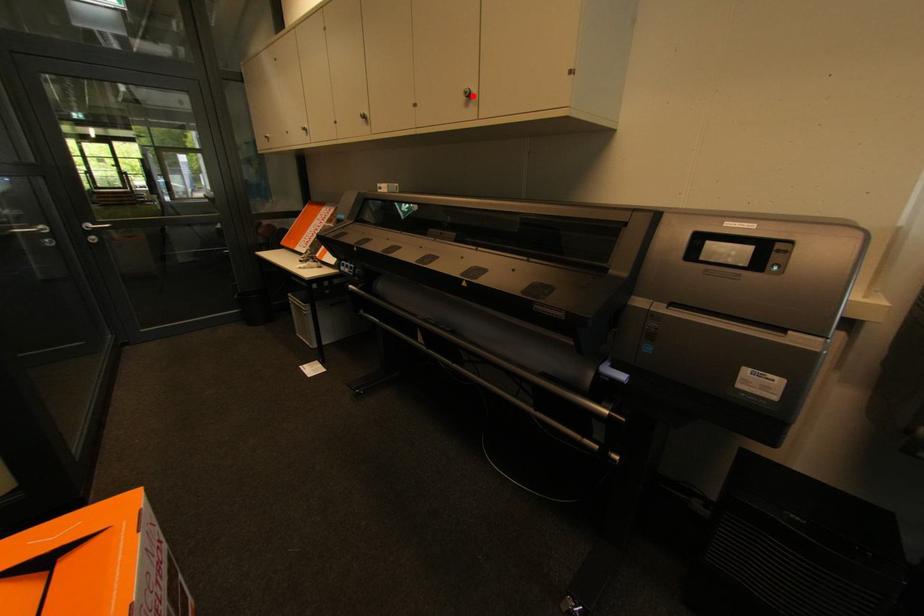
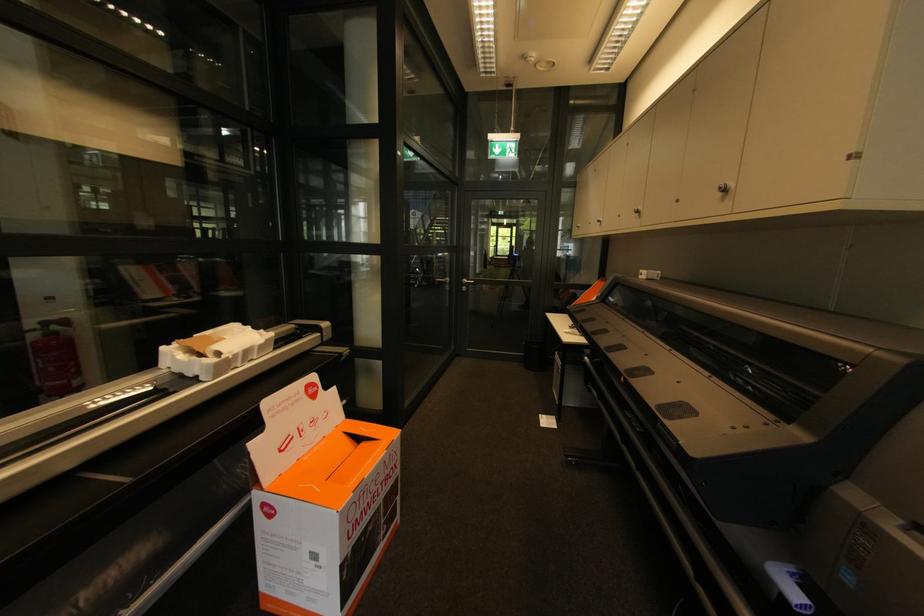
The point at the highlighted location is marked in the first image. Where is the corresponding point in the second image?

(727, 191)